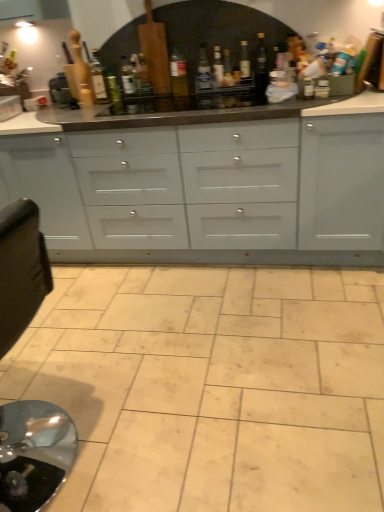
Question: Is translucent glass bottle at center, which ranks as the 8th bottle in left-to-right order, smaller than translucent glass bottle at center, acting as the fifth bottle starting from the right?

Choices:
 (A) no
 (B) yes

Answer: (B)

Question: Is translucent glass bottle at center, which ranks as the 8th bottle in left-to-right order, to the right of translucent glass bottle at center, acting as the fifth bottle starting from the right, from the viewer's perspective?

Choices:
 (A) yes
 (B) no

Answer: (A)

Question: From the image's perspective, does translucent glass bottle at center, which ranks as the 8th bottle in left-to-right order, appear higher than translucent glass bottle at center, acting as the fifth bottle starting from the right?

Choices:
 (A) yes
 (B) no

Answer: (B)

Question: Does translucent glass bottle at center, the 3th bottle when ordered from right to left, appear on the left side of translucent glass bottle at center, the 6th bottle positioned from the left?

Choices:
 (A) no
 (B) yes

Answer: (A)

Question: Is translucent glass bottle at center, the 3th bottle when ordered from right to left, further to camera compared to translucent glass bottle at center, acting as the fifth bottle starting from the right?

Choices:
 (A) yes
 (B) no

Answer: (B)

Question: Considering the relative sizes of translucent glass bottle at center, which ranks as the 8th bottle in left-to-right order, and translucent glass bottle at center, acting as the fifth bottle starting from the right, in the image provided, is translucent glass bottle at center, which ranks as the 8th bottle in left-to-right order, shorter than translucent glass bottle at center, acting as the fifth bottle starting from the right,?

Choices:
 (A) yes
 (B) no

Answer: (B)

Question: Is translucent glass bottle at center, which ranks as the 8th bottle in left-to-right order, at the right side of translucent glass bottle at center, marked as the sixth bottle in a right-to-left arrangement?

Choices:
 (A) no
 (B) yes

Answer: (B)

Question: From the image's perspective, is translucent glass bottle at center, the 3th bottle when ordered from right to left, beneath translucent glass bottle at center, arranged as the fifth bottle when viewed from the left?

Choices:
 (A) no
 (B) yes

Answer: (B)

Question: From a real-world perspective, is translucent glass bottle at center, the 3th bottle when ordered from right to left, physically below translucent glass bottle at center, marked as the sixth bottle in a right-to-left arrangement?

Choices:
 (A) yes
 (B) no

Answer: (A)

Question: Could translucent glass bottle at center, marked as the sixth bottle in a right-to-left arrangement, be considered to be inside translucent glass bottle at center, the 3th bottle when ordered from right to left?

Choices:
 (A) yes
 (B) no

Answer: (B)

Question: Does translucent glass bottle at center, the 3th bottle when ordered from right to left, turn towards translucent glass bottle at center, arranged as the fifth bottle when viewed from the left?

Choices:
 (A) no
 (B) yes

Answer: (A)

Question: Can you confirm if translucent glass bottle at center, which ranks as the 8th bottle in left-to-right order, is shorter than translucent glass bottle at center, marked as the sixth bottle in a right-to-left arrangement?

Choices:
 (A) yes
 (B) no

Answer: (B)

Question: Can you confirm if white glossy cabinets at center is taller than translucent glass bottle at center, which ranks as the 8th bottle in left-to-right order?

Choices:
 (A) no
 (B) yes

Answer: (B)